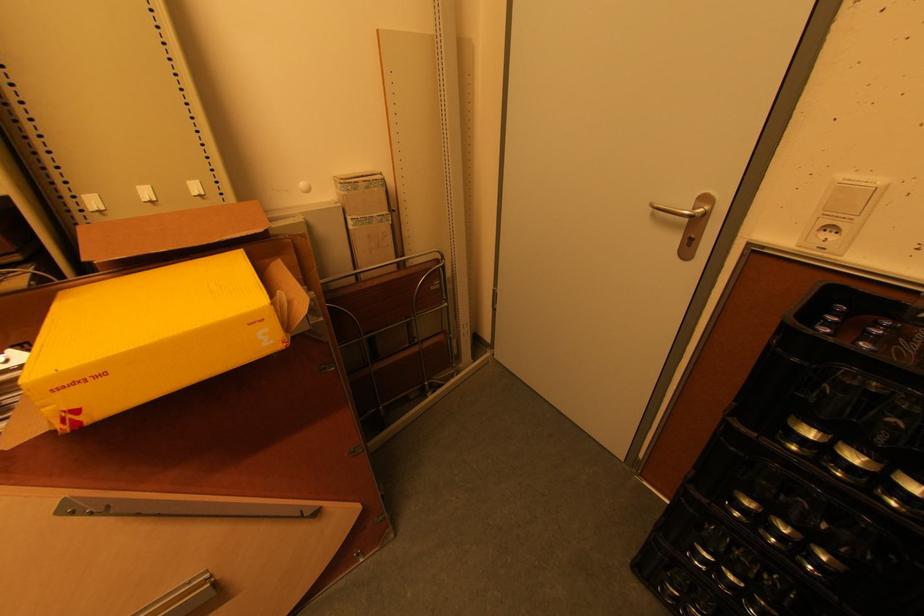
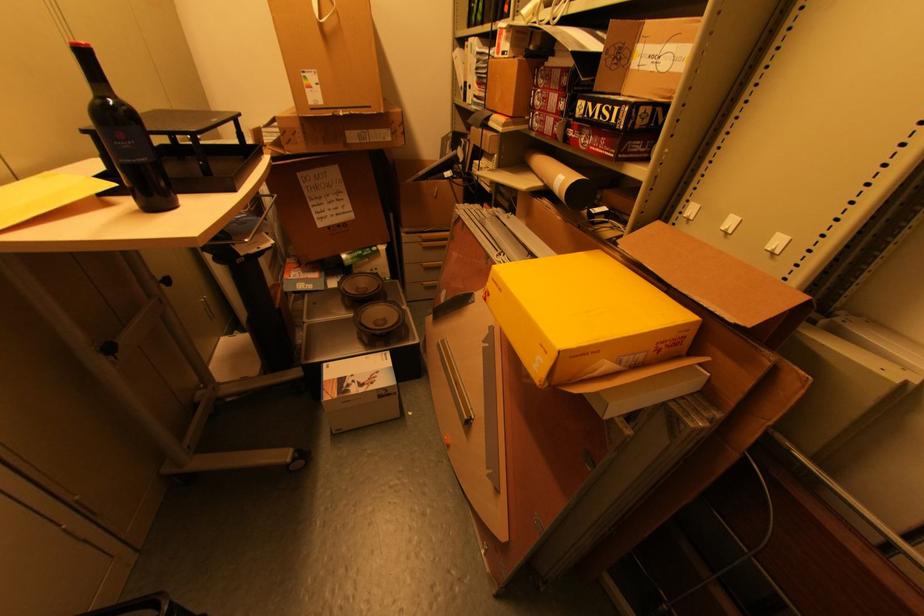
In the second image, find the point that corresponds to point (221, 241) in the first image.

(688, 294)